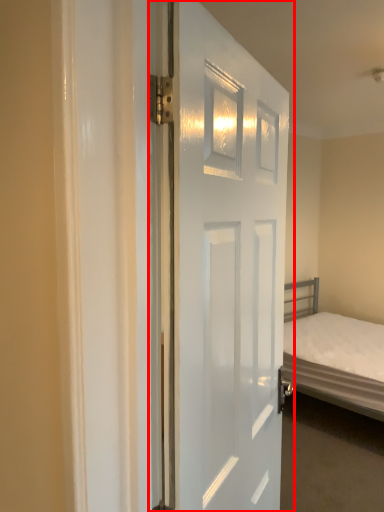
Question: Considering the relative positions of door (annotated by the red box) and bed in the image provided, where is door (annotated by the red box) located with respect to the staircase?

Choices:
 (A) right
 (B) left

Answer: (B)